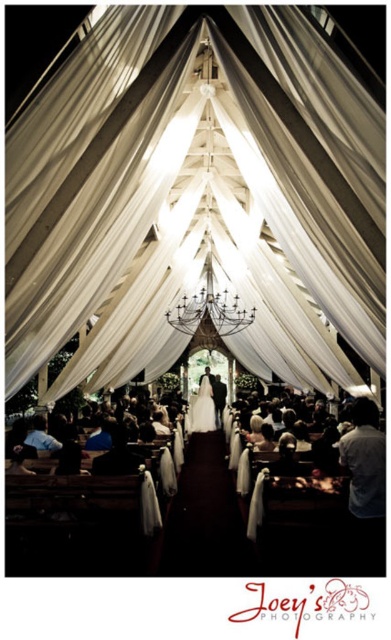
Which is behind, point (172, 506) or point (355, 506)?

Point (172, 506)

How much distance is there between white satin aisle at center and gray fabric at right?

A distance of 3.45 meters exists between white satin aisle at center and gray fabric at right.

Does point (199, 438) come behind point (358, 417)?

That is True.

Where is `white satin aisle at center`? white satin aisle at center is located at coordinates (204, 515).

Can you confirm if black wrought iron chandelier at center is positioned above white satin dress at center?

Yes, black wrought iron chandelier at center is above white satin dress at center.

Where is `black wrought iron chandelier at center`? Image resolution: width=391 pixels, height=640 pixels. black wrought iron chandelier at center is located at coordinates (209, 310).

At what (x,y) coordinates should I click in order to perform the action: click on black wrought iron chandelier at center. Please return your answer as a coordinate pair (x, y). Looking at the image, I should click on (209, 310).

Consider the image. Between white sheer fabric at center and white satin aisle at center, which one is positioned lower?

Positioned lower is white satin aisle at center.

Is white sheer fabric at center behind white satin aisle at center?

No, white sheer fabric at center is closer to the viewer.

Find the location of a particular element. Image resolution: width=391 pixels, height=640 pixels. white sheer fabric at center is located at coordinates (195, 195).